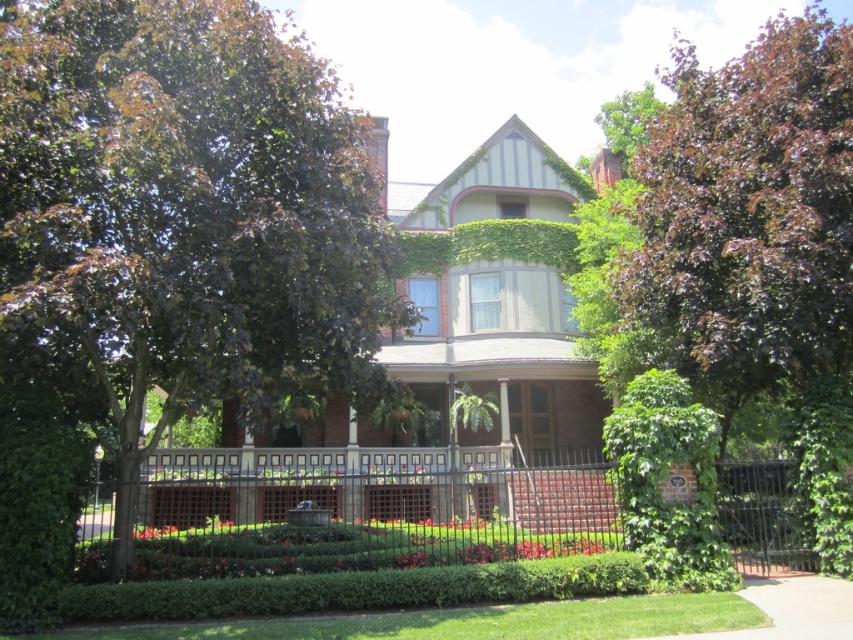
Does dark green leafy tree at upper left come behind black metal fence at center?

No, it is in front of black metal fence at center.

At what (x,y) coordinates should I click in order to perform the action: click on dark green leafy tree at upper left. Please return your answer as a coordinate pair (x, y). The height and width of the screenshot is (640, 853). Looking at the image, I should click on (186, 212).

Locate an element on the screen. dark green leafy tree at upper left is located at coordinates [x=186, y=212].

Is black metal fence at center thinner than green leafy bush at lower right?

Incorrect, black metal fence at center's width is not less than green leafy bush at lower right's.

Who is higher up, black metal fence at center or green leafy bush at lower right?

green leafy bush at lower right is higher up.

Does point (277, 572) lie behind point (656, 371)?

That is False.

This screenshot has height=640, width=853. In order to click on black metal fence at center in this screenshot , I will do `click(369, 518)`.

Is dark green leafy tree at upper left thinner than green leafy bush at lower right?

Incorrect, dark green leafy tree at upper left's width is not less than green leafy bush at lower right's.

Does dark green leafy tree at upper left appear over green leafy bush at lower right?

Yes.

Which is behind, point (274, 38) or point (683, 378)?

Positioned behind is point (683, 378).

At what (x,y) coordinates should I click in order to perform the action: click on dark green leafy tree at upper left. Please return your answer as a coordinate pair (x, y). Looking at the image, I should click on (186, 212).